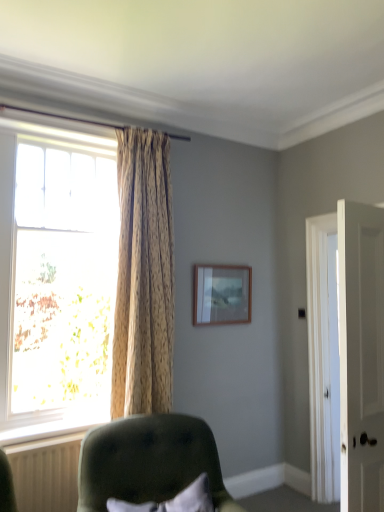
Question: Is point pyautogui.click(x=76, y=480) positioned closer to the camera than point pyautogui.click(x=109, y=224)?

Choices:
 (A) closer
 (B) farther

Answer: (A)

Question: In the image, is white plastic radiator at lower left positioned in front of or behind translucent glass window at left?

Choices:
 (A) behind
 (B) front

Answer: (B)

Question: Estimate the real-world distances between objects in this image. Which object is farther from the translucent glass window at left?

Choices:
 (A) soft white pillow at lower center
 (B) white smooth door at right
 (C) velvet green chair at lower center
 (D) wooden frame at upper center
 (E) floral fabric curtain at left

Answer: (B)

Question: Estimate the real-world distances between objects in this image. Which object is closer to the white plastic radiator at lower left?

Choices:
 (A) floral fabric curtain at left
 (B) velvet green chair at lower center
 (C) wooden frame at upper center
 (D) translucent glass window at left
 (E) white smooth door at right

Answer: (B)